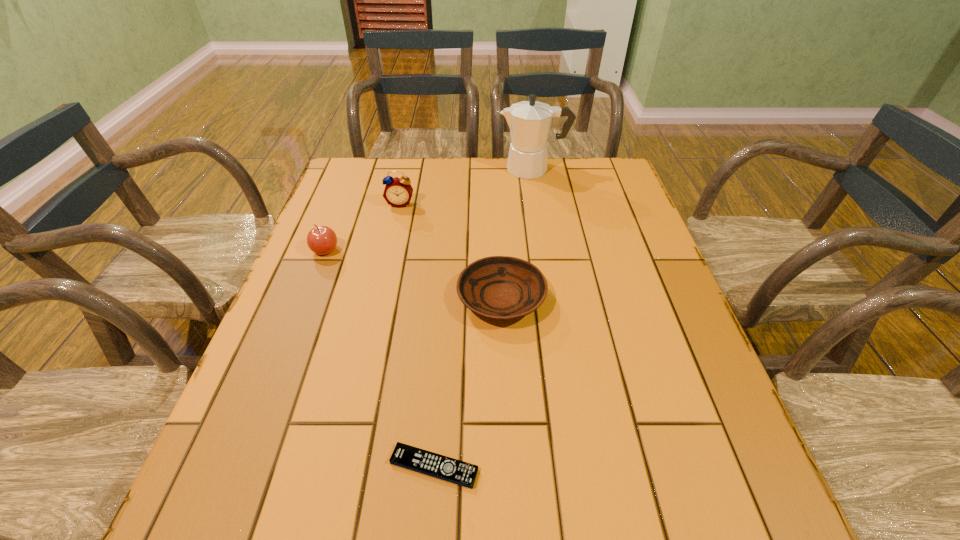
Locate an element on the screen. The image size is (960, 540). blank region between the shortest object and the second shortest object is located at coordinates (468, 382).

Locate an element on the screen. unoccupied position between the nearest object and the farthest object is located at coordinates (484, 318).

Locate an element on the screen. free space between the second shortest object and the remote control is located at coordinates (468, 382).

Where is `unoccupied position between the plate and the third nearest object`? unoccupied position between the plate and the third nearest object is located at coordinates pos(414,274).

Locate an element on the screen. Image resolution: width=960 pixels, height=540 pixels. vacant region between the second tallest object and the tallest object is located at coordinates click(467, 186).

This screenshot has height=540, width=960. What are the coordinates of `the closest object to the third shortest object` in the screenshot? It's located at (398, 191).

Identify which object is the closest to the farthest object. Please provide its 2D coordinates. Your answer should be formatted as a tuple, i.e. [(x, y)], where the tuple contains the x and y coordinates of a point satisfying the conditions above.

[(398, 191)]

Where is `free spot that satisfies the following two spatial constraints: 1. at the spout of the farthest object; 2. on the front side of the apple`? free spot that satisfies the following two spatial constraints: 1. at the spout of the farthest object; 2. on the front side of the apple is located at coordinates (547, 251).

You are a GUI agent. You are given a task and a screenshot of the screen. Output one action in this format:
    pyautogui.click(x=<x>, y=<y>)
    Task: Click on the free location that satisfies the following two spatial constraints: 1. on the front-facing side of the nearest object; 2. on the left side of the second tallest object
    This screenshot has width=960, height=540.
    Given the screenshot: What is the action you would take?
    pyautogui.click(x=341, y=467)

At what (x,y) coordinates should I click in order to perform the action: click on free space that satisfies the following two spatial constraints: 1. on the front-facing side of the alarm clock; 2. on the right side of the plate. Please return your answer as a coordinate pair (x, y). This screenshot has width=960, height=540. Looking at the image, I should click on (379, 298).